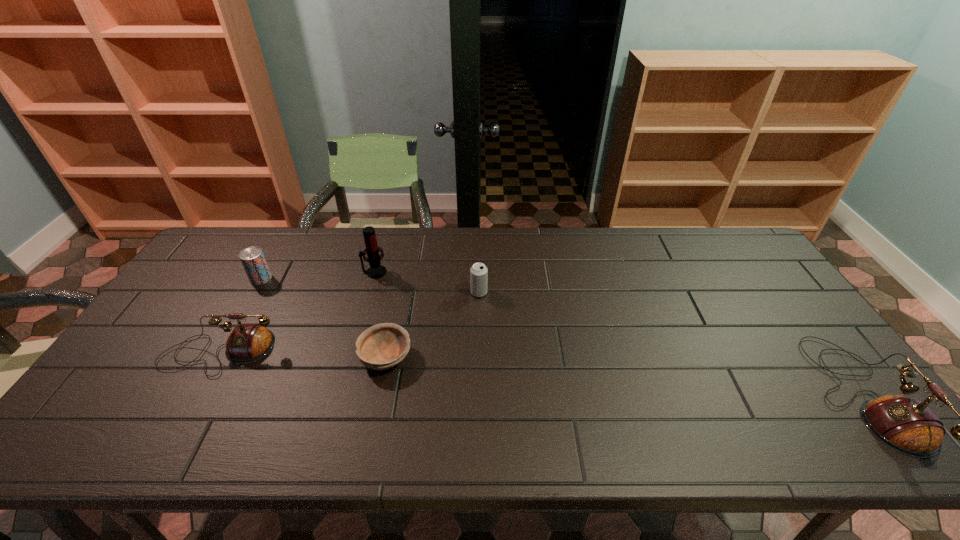
Find the location of a particular element. The image size is (960, 540). vacant position located 0.370m on the right of the microphone is located at coordinates click(502, 272).

Identify the location of object at the far edge. This screenshot has height=540, width=960. (376, 270).

Locate an element on the screen. The image size is (960, 540). object that is at the left edge is located at coordinates (248, 342).

The height and width of the screenshot is (540, 960). I want to click on free point at the far edge, so click(x=596, y=249).

This screenshot has height=540, width=960. In the image, there is a desktop. What are the coordinates of `vacant area at the near edge` in the screenshot? It's located at (509, 409).

Locate an element on the screen. Image resolution: width=960 pixels, height=540 pixels. vacant space at the left edge of the desktop is located at coordinates (134, 357).

Identify the location of free space at the right edge of the desktop. This screenshot has height=540, width=960. (726, 280).

This screenshot has height=540, width=960. In the image, there is a desktop. What are the coordinates of `free space at the far left corner` in the screenshot? It's located at (236, 245).

In the image, there is a desktop. Where is `free region at the near left corner`? This screenshot has width=960, height=540. free region at the near left corner is located at coordinates (122, 393).

The width and height of the screenshot is (960, 540). In order to click on free space at the near right corner of the desktop in this screenshot , I will do `click(798, 390)`.